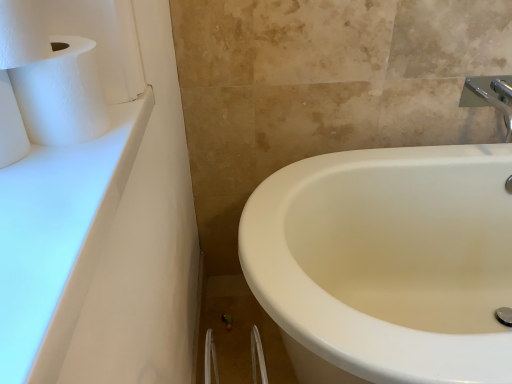
Describe the element at coordinates (58, 239) in the screenshot. I see `white glossy countertop at upper left` at that location.

In order to face white matte paper towel at upper left, should I rotate leftwards or rightwards?

You should rotate left by 23.726 degrees.

Locate an element on the screen. The height and width of the screenshot is (384, 512). white glossy countertop at upper left is located at coordinates (58, 239).

Which object is positioned more to the right, white matte paper towel at upper left or white textured toilet paper at upper left, the second toilet paper from the bottom?

white matte paper towel at upper left is more to the right.

From a real-world perspective, is white matte paper towel at upper left physically above white textured toilet paper at upper left, the 1th toilet paper from the top?

No, from a real-world perspective, white matte paper towel at upper left is not over white textured toilet paper at upper left, the 1th toilet paper from the top

Is point (61, 139) closer to viewer compared to point (3, 9)?

No, it is not.

Which is closer to the camera, [23,51] or [22,221]?

Point [23,51] is farther from the camera than point [22,221].

Which of these two, white textured toilet paper at upper left, the 1th toilet paper from the top, or white glossy countertop at upper left, is thinner?

white textured toilet paper at upper left, the 1th toilet paper from the top.

Looking at this image, between white textured toilet paper at upper left, the 1th toilet paper from the top, and white glossy countertop at upper left, which one has smaller size?

white textured toilet paper at upper left, the 1th toilet paper from the top, is smaller.

Is silver metallic faucet at upper right to the left or to the right of white textured toilet paper at upper left, the 1th toilet paper from the top, in the image?

Based on their positions, silver metallic faucet at upper right is located to the right of white textured toilet paper at upper left, the 1th toilet paper from the top.

Between silver metallic faucet at upper right and white textured toilet paper at upper left, the 1th toilet paper from the top, which one has larger size?

Bigger between the two is silver metallic faucet at upper right.

From the silver metallic faucet at upper right, count the 1st toilet paper to the left and point to it. Please provide its 2D coordinates.

[(22, 34)]

Is the position of silver metallic faucet at upper right more distant than that of white textured toilet paper at upper left, the 1th toilet paper from the top?

That is True.

Is point (510, 76) farther from camera compared to point (11, 144)?

Yes, it is behind point (11, 144).

Is silver metallic faucet at upper right taller than white matte toilet paper at left, the 1th toilet paper when ordered from bottom to top?

Indeed, silver metallic faucet at upper right has a greater height compared to white matte toilet paper at left, the 1th toilet paper when ordered from bottom to top.

Is silver metallic faucet at upper right outside of white matte toilet paper at left, which is the 2th toilet paper in top-to-bottom order?

Yes.

Is silver metallic faucet at upper right turned away from white glossy countertop at upper left?

No, silver metallic faucet at upper right's orientation is not away from white glossy countertop at upper left.

Locate an element on the screen. counter top that is below the silver metallic faucet at upper right (from the image's perspective) is located at coordinates (58, 239).

Choose the correct answer: Is silver metallic faucet at upper right inside white glossy countertop at upper left or outside it?

silver metallic faucet at upper right is not inside white glossy countertop at upper left, it's outside.

Is the depth of silver metallic faucet at upper right greater than that of white glossy countertop at upper left?

Yes.

Is white matte toilet paper at left, the 1th toilet paper when ordered from bottom to top, looking in the opposite direction of white glossy countertop at upper left?

That's not correct — white matte toilet paper at left, the 1th toilet paper when ordered from bottom to top, is not looking away from white glossy countertop at upper left.

Is white matte toilet paper at left, which is the 2th toilet paper in top-to-bottom order, further to camera compared to white glossy countertop at upper left?

Yes, white matte toilet paper at left, which is the 2th toilet paper in top-to-bottom order, is behind white glossy countertop at upper left.

Considering the relative positions of white matte toilet paper at left, the 1th toilet paper when ordered from bottom to top, and white glossy countertop at upper left in the image provided, is white matte toilet paper at left, the 1th toilet paper when ordered from bottom to top, to the left of white glossy countertop at upper left from the viewer's perspective?

Indeed, white matte toilet paper at left, the 1th toilet paper when ordered from bottom to top, is positioned on the left side of white glossy countertop at upper left.

Which of these two, white matte toilet paper at left, the 1th toilet paper when ordered from bottom to top, or white glossy countertop at upper left, is thinner?

Thinner between the two is white matte toilet paper at left, the 1th toilet paper when ordered from bottom to top.

Is white matte paper towel at upper left in front of or behind white matte toilet paper at left, which is the 2th toilet paper in top-to-bottom order, in the image?

white matte paper towel at upper left is positioned farther from the viewer than white matte toilet paper at left, which is the 2th toilet paper in top-to-bottom order.

Can white matte toilet paper at left, which is the 2th toilet paper in top-to-bottom order, be found inside white matte paper towel at upper left?

Actually, white matte toilet paper at left, which is the 2th toilet paper in top-to-bottom order, is outside white matte paper towel at upper left.

From the image's perspective, between white matte paper towel at upper left and white matte toilet paper at left, which is the 2th toilet paper in top-to-bottom order, which one is located above?

white matte paper towel at upper left appears higher in the image.

What are the coordinates of `paper towel below the white textured toilet paper at upper left, the 1th toilet paper from the top (from a real-world perspective)` in the screenshot? It's located at (62, 94).

From the white glossy countertop at upper left, count 1st toilet papers backward and point to it. Please provide its 2D coordinates.

[(22, 34)]

Looking at the image, which one is located closer to white matte paper towel at upper left, white matte toilet paper at left, which is the 2th toilet paper in top-to-bottom order, or white textured toilet paper at upper left, the 1th toilet paper from the top?

white textured toilet paper at upper left, the 1th toilet paper from the top.

Estimate the real-world distances between objects in this image. Which object is further from white matte toilet paper at left, the 1th toilet paper when ordered from bottom to top, white matte paper towel at upper left or white textured toilet paper at upper left, the second toilet paper from the bottom?

white textured toilet paper at upper left, the second toilet paper from the bottom, lies further to white matte toilet paper at left, the 1th toilet paper when ordered from bottom to top, than the other object.

From the image, which object appears to be nearer to silver metallic faucet at upper right, white matte paper towel at upper left or white matte toilet paper at left, which is the 2th toilet paper in top-to-bottom order?

The object closer to silver metallic faucet at upper right is white matte paper towel at upper left.

When comparing their distances from white matte toilet paper at left, which is the 2th toilet paper in top-to-bottom order, does white textured toilet paper at upper left, the second toilet paper from the bottom, or white matte paper towel at upper left seem further?

Based on the image, white textured toilet paper at upper left, the second toilet paper from the bottom, appears to be further to white matte toilet paper at left, which is the 2th toilet paper in top-to-bottom order.

Estimate the real-world distances between objects in this image. Which object is further from white glossy countertop at upper left, white matte paper towel at upper left or white textured toilet paper at upper left, the second toilet paper from the bottom?

white textured toilet paper at upper left, the second toilet paper from the bottom.

Considering their positions, is white glossy countertop at upper left positioned closer to silver metallic faucet at upper right than white matte toilet paper at left, the 1th toilet paper when ordered from bottom to top?

white glossy countertop at upper left is positioned closer to the anchor silver metallic faucet at upper right.

Consider the image. From the image, which object appears to be nearer to white glossy countertop at upper left, white matte paper towel at upper left or silver metallic faucet at upper right?

white matte paper towel at upper left is closer to white glossy countertop at upper left.

Which object lies further to the anchor point white matte paper towel at upper left, silver metallic faucet at upper right or white glossy countertop at upper left?

silver metallic faucet at upper right is positioned further to the anchor white matte paper towel at upper left.

Identify the location of toilet paper situated between white matte toilet paper at left, the 1th toilet paper when ordered from bottom to top, and silver metallic faucet at upper right from left to right. Image resolution: width=512 pixels, height=384 pixels. (22, 34).

Where is `paper towel between white textured toilet paper at upper left, the second toilet paper from the bottom, and white matte toilet paper at left, the 1th toilet paper when ordered from bottom to top, vertically`? The width and height of the screenshot is (512, 384). paper towel between white textured toilet paper at upper left, the second toilet paper from the bottom, and white matte toilet paper at left, the 1th toilet paper when ordered from bottom to top, vertically is located at coordinates (62, 94).

I want to click on counter top between white matte toilet paper at left, which is the 2th toilet paper in top-to-bottom order, and silver metallic faucet at upper right, in the horizontal direction, so click(58, 239).

Where is `toilet paper between white textured toilet paper at upper left, the second toilet paper from the bottom, and white glossy countertop at upper left, in the vertical direction`? The width and height of the screenshot is (512, 384). toilet paper between white textured toilet paper at upper left, the second toilet paper from the bottom, and white glossy countertop at upper left, in the vertical direction is located at coordinates (11, 125).